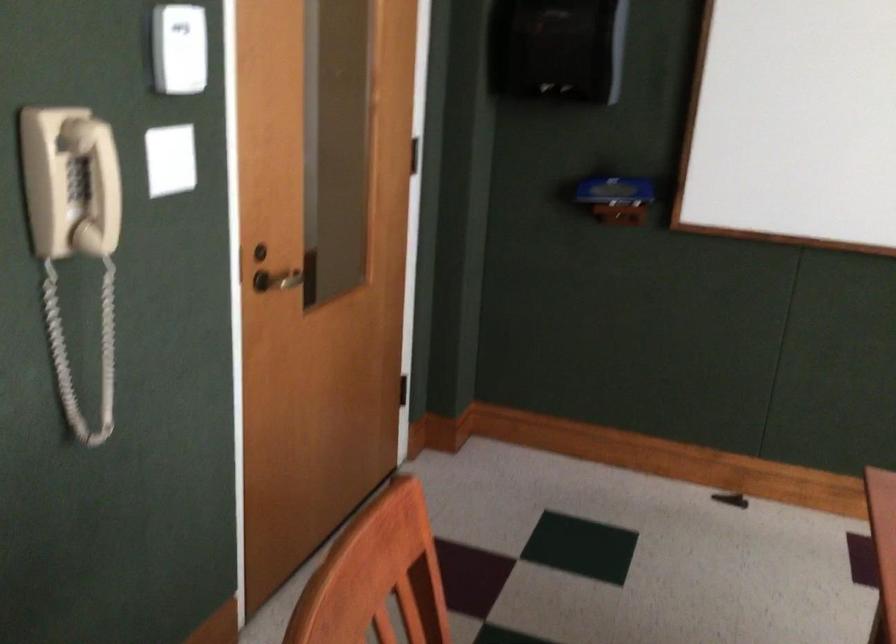
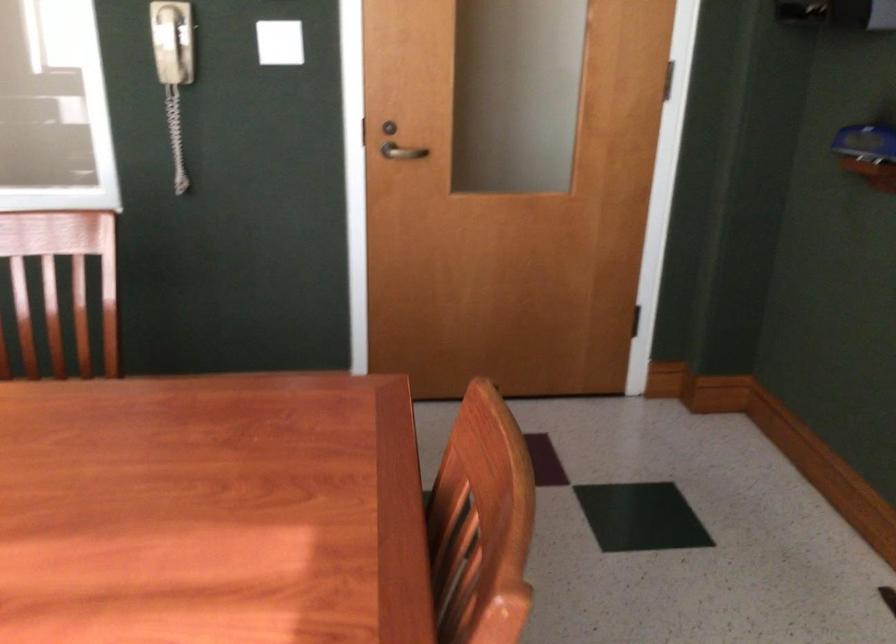
The point at (288, 285) is marked in the first image. Where is the corresponding point in the second image?

(401, 152)